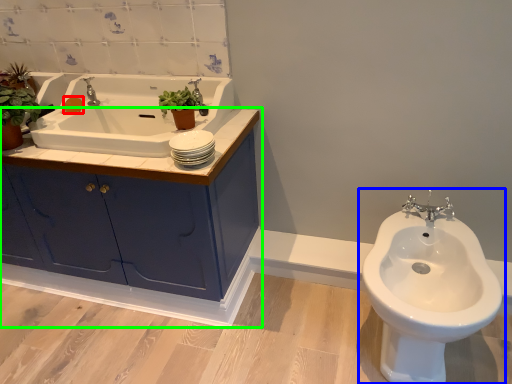
Question: Considering the real-world distances, which object is closest to soap (highlighted by a red box)? toilet (highlighted by a blue box) or bathroom cabinet (highlighted by a green box).

Choices:
 (A) toilet
 (B) bathroom cabinet

Answer: (B)